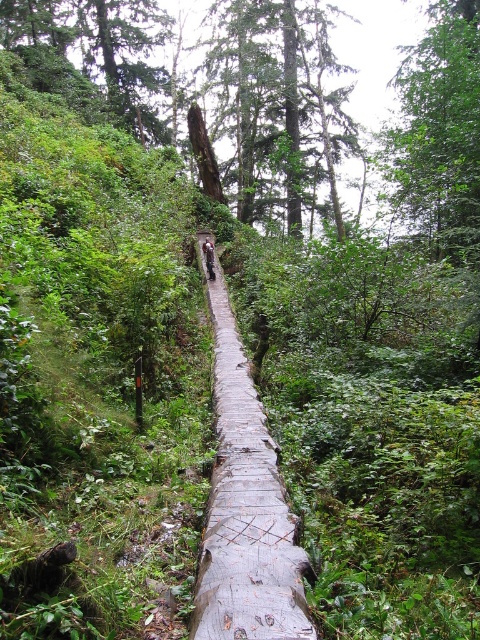
Is point (282, 605) less distant than point (437, 205)?

Yes, point (282, 605) is closer to viewer.

This screenshot has width=480, height=640. Find the location of `weathered wood bridge at center`. weathered wood bridge at center is located at coordinates (245, 509).

Image resolution: width=480 pixels, height=640 pixels. Identify the location of weathered wood bridge at center. (245, 509).

This screenshot has width=480, height=640. I want to click on weathered wood bridge at center, so click(x=245, y=509).

Can you confirm if weathered wood bridge at center is shorter than camouflage jacket at center?

Indeed, weathered wood bridge at center has a lesser height compared to camouflage jacket at center.

Consider the image. Is weathered wood bridge at center thinner than camouflage jacket at center?

Incorrect, weathered wood bridge at center's width is not less than camouflage jacket at center's.

Does point (206, 285) come in front of point (211, 244)?

Yes, point (206, 285) is closer to viewer.

Where is `weathered wood bridge at center`? Image resolution: width=480 pixels, height=640 pixels. weathered wood bridge at center is located at coordinates (245, 509).

Who is positioned more to the left, green rough bark tree at upper center or camouflage jacket at center?

camouflage jacket at center is more to the left.

Does green rough bark tree at upper center have a greater width compared to camouflage jacket at center?

Yes.

Between point (295, 17) and point (213, 253), which one is positioned in front?

Point (213, 253) is in front.

Where is `green rough bark tree at upper center`? The width and height of the screenshot is (480, 640). green rough bark tree at upper center is located at coordinates (278, 104).